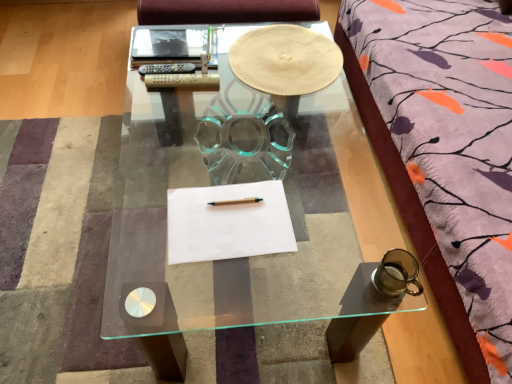
The width and height of the screenshot is (512, 384). In order to click on free point above matte cardboard plate at center (from a real-world perspective) in this screenshot , I will do [x=282, y=44].